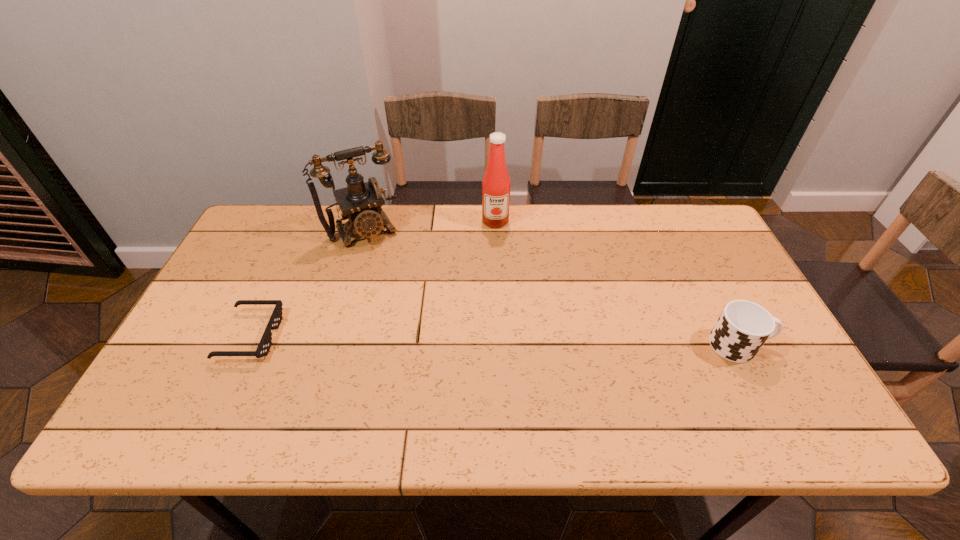
This screenshot has height=540, width=960. In order to click on free spot located 0.380m on the front-facing side of the condiment in this screenshot , I will do `click(499, 320)`.

The height and width of the screenshot is (540, 960). I want to click on vacant region located on the front-facing side of the condiment, so click(499, 306).

This screenshot has width=960, height=540. Find the location of `free space located 0.390m on the front-facing side of the condiment`. free space located 0.390m on the front-facing side of the condiment is located at coordinates (500, 323).

Locate an element on the screen. The image size is (960, 540). telephone present at the far edge is located at coordinates (360, 203).

Where is `condiment situated at the far edge`? condiment situated at the far edge is located at coordinates (496, 182).

This screenshot has height=540, width=960. In order to click on object situated at the left edge in this screenshot , I will do `click(265, 343)`.

The width and height of the screenshot is (960, 540). I want to click on object that is at the right edge, so click(x=743, y=327).

Locate an element on the screen. The image size is (960, 540). vacant space at the far edge of the desktop is located at coordinates (603, 242).

In the image, there is a desktop. Identify the location of vacant space at the near edge. This screenshot has height=540, width=960. (274, 380).

The image size is (960, 540). In the image, there is a desktop. In order to click on vacant space at the left edge in this screenshot , I will do `click(214, 306)`.